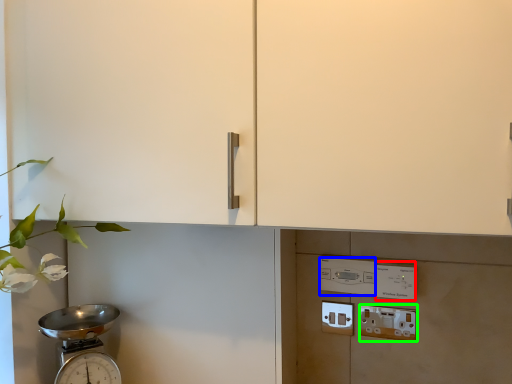
Question: Which object is the closest to the light switch (highlighted by a red box)? Choose among these: light switch (highlighted by a blue box) or electric outlet (highlighted by a green box).

Choices:
 (A) light switch
 (B) electric outlet

Answer: (A)